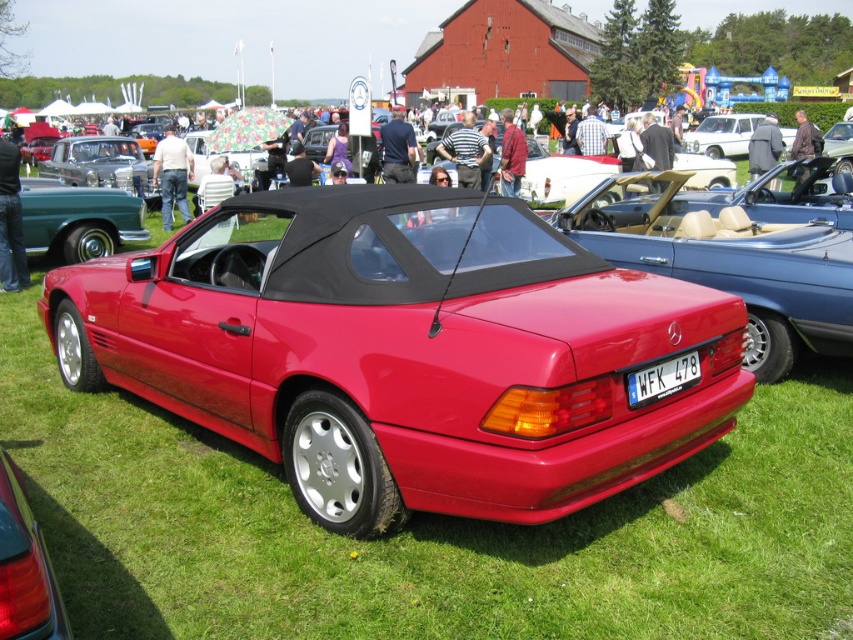
Which is below, metallic silver convertible at center or white plastic license plate at center?

white plastic license plate at center

Who is higher up, metallic silver convertible at center or white plastic license plate at center?

Positioned higher is metallic silver convertible at center.

The image size is (853, 640). Identify the location of metallic silver convertible at center. [722, 134].

Does matte red convertible at center have a greater width compared to metallic silver convertible at center?

In fact, matte red convertible at center might be narrower than metallic silver convertible at center.

Is matte red convertible at center to the right of metallic silver convertible at center from the viewer's perspective?

No, matte red convertible at center is not to the right of metallic silver convertible at center.

Locate an element on the screen. This screenshot has height=640, width=853. matte red convertible at center is located at coordinates (404, 352).

Which is below, shiny silver sedan at left or white plastic license plate at center?

white plastic license plate at center

How far apart are shiny silver sedan at left and white plastic license plate at center?

shiny silver sedan at left and white plastic license plate at center are 16.39 meters apart from each other.

Does point (129, 184) come closer to viewer compared to point (692, 384)?

That is False.

In order to click on shiny silver sedan at left in this screenshot , I will do `click(97, 163)`.